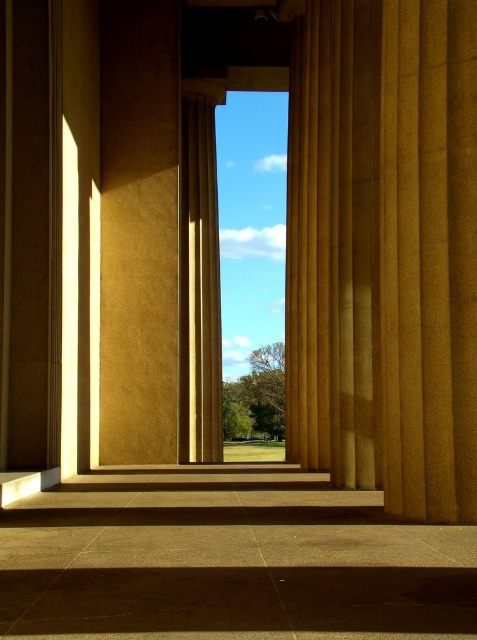
You are standing inside a classical building and want to exit through the gap between the golden stone pillar at center and the matte gold column at center. Which pillar should you move towards if you want to exit to the right side of the structure?

To exit to the right side of the structure, you should move towards the golden stone pillar at center because it is positioned to the right of the matte gold column at center, so exiting towards its right side would lead you in the desired direction.

You are standing inside the classical structure looking through the columns. There are two points marked in the image. The first point is at coordinate point [396,3] and the second is at point [199,244]. Which of these two points is nearer to you?

Point [396,3] is closer to the viewer than point [199,244].